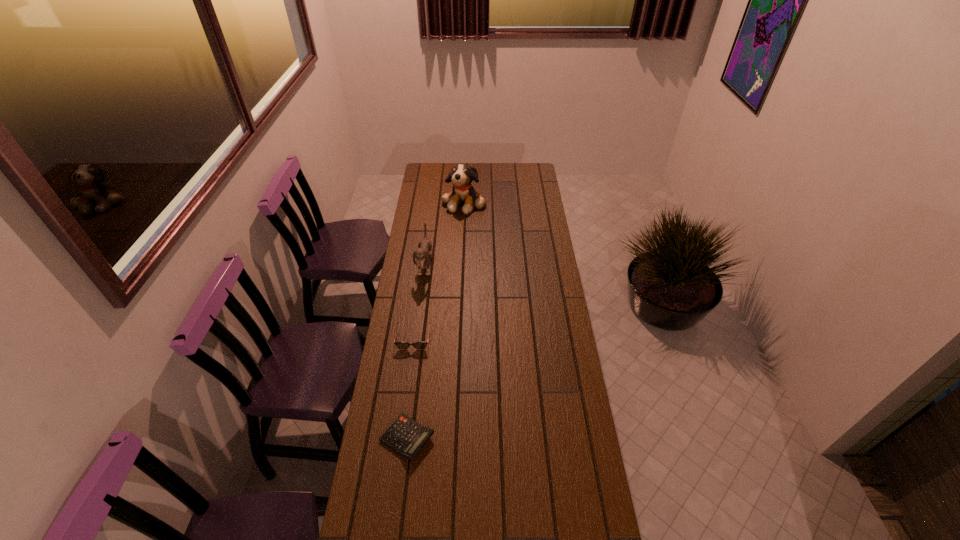
What are the coordinates of `the farthest object` in the screenshot? It's located at (461, 176).

The width and height of the screenshot is (960, 540). What are the coordinates of `the taller puppy` in the screenshot? It's located at (461, 176).

You are a GUI agent. You are given a task and a screenshot of the screen. Output one action in this format:
    pyautogui.click(x=<x>, y=<y>)
    Task: Click on the shorter puppy
    
    Given the screenshot: What is the action you would take?
    pyautogui.click(x=422, y=254)

Where is `the left puppy`? The width and height of the screenshot is (960, 540). the left puppy is located at coordinates (422, 254).

Locate an element on the screen. the second nearest object is located at coordinates (400, 345).

Locate an element on the screen. the third tallest object is located at coordinates (400, 345).

Identify the location of the nearest object. The image size is (960, 540). (406, 437).

The width and height of the screenshot is (960, 540). I want to click on calculator, so click(x=406, y=437).

I want to click on free space located at the face of the farther puppy, so click(463, 237).

This screenshot has width=960, height=540. Find the location of `free space located 0.360m at the face of the third nearest object`. free space located 0.360m at the face of the third nearest object is located at coordinates (509, 266).